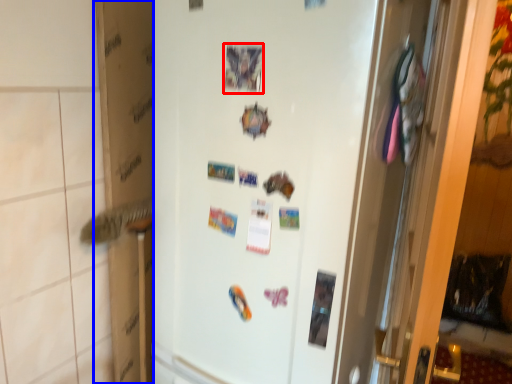
Question: Among these objects, which one is nearest to the camera, postcard (highlighted by a red box) or cardboard box (highlighted by a blue box)?

Choices:
 (A) postcard
 (B) cardboard box

Answer: (A)